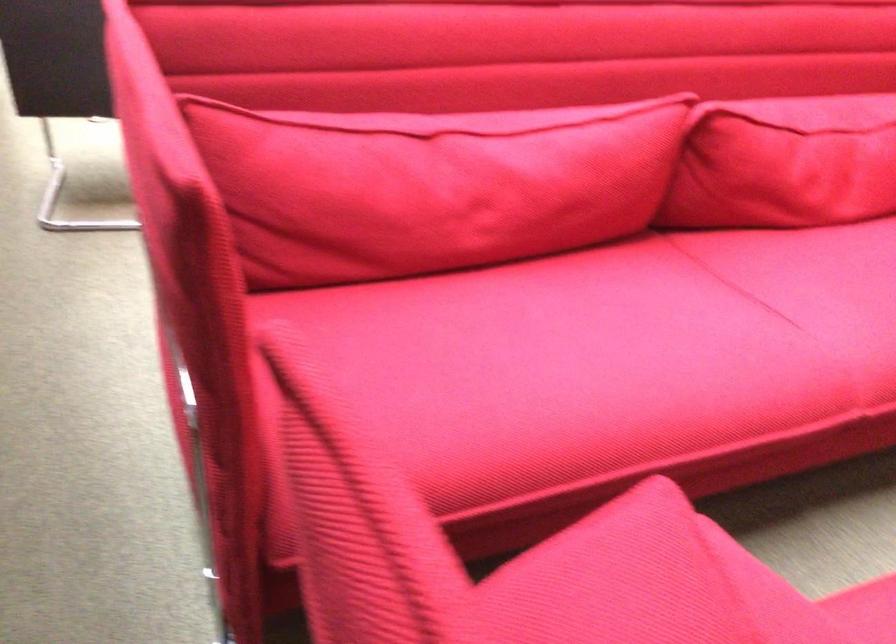
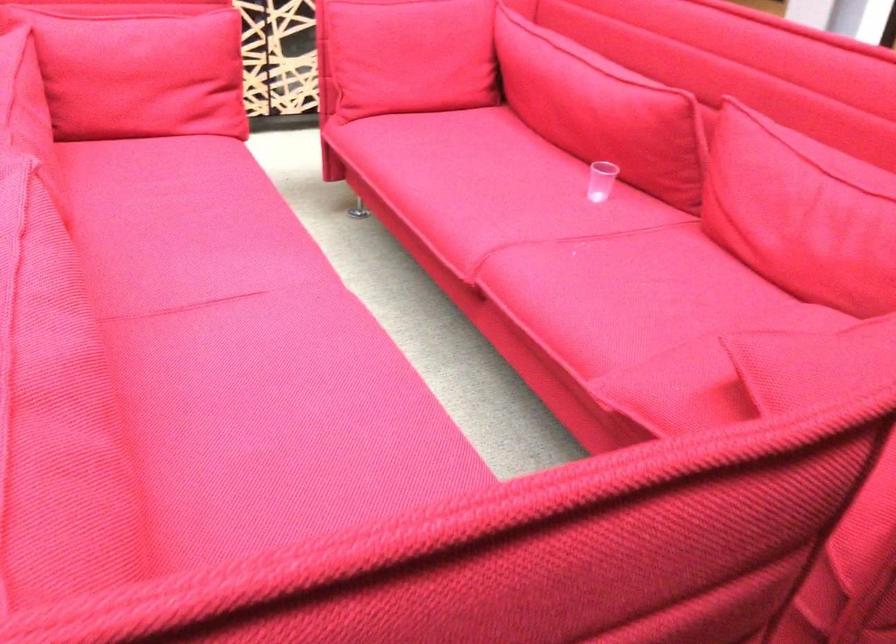
Where in the second image is the point corresponding to the point at 692,305 from the first image?

(243, 337)